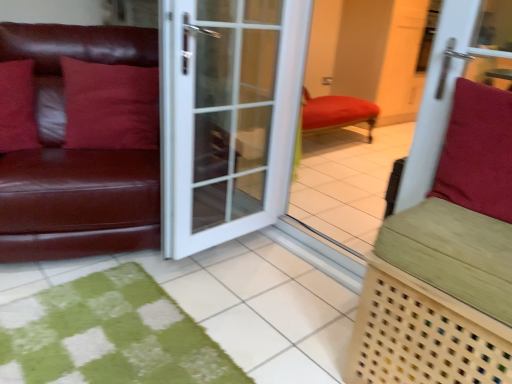
Question: Considering the relative positions of suede-like red cushion at right, which ranks as the first pillow in front-to-back order, and matte red pillow at left, the 2th pillow from the right, in the image provided, is suede-like red cushion at right, which ranks as the first pillow in front-to-back order, to the left of matte red pillow at left, the 2th pillow from the right, from the viewer's perspective?

Choices:
 (A) no
 (B) yes

Answer: (A)

Question: Considering the relative sizes of suede-like red cushion at right, arranged as the 1th pillow when viewed from the right, and matte red pillow at left, the 2th pillow from the right, in the image provided, is suede-like red cushion at right, arranged as the 1th pillow when viewed from the right, bigger than matte red pillow at left, the 2th pillow from the right,?

Choices:
 (A) no
 (B) yes

Answer: (A)

Question: Is suede-like red cushion at right, which ranks as the first pillow in front-to-back order, outside matte red pillow at left, marked as the third pillow in a front-to-back arrangement?

Choices:
 (A) no
 (B) yes

Answer: (B)

Question: Can you confirm if suede-like red cushion at right, which ranks as the first pillow in front-to-back order, is thinner than matte red pillow at left, the 2th pillow from the right?

Choices:
 (A) yes
 (B) no

Answer: (B)

Question: From a real-world perspective, is suede-like red cushion at right, which ranks as the first pillow in front-to-back order, located higher than matte red pillow at left, which appears as the 1th pillow when viewed from the back?

Choices:
 (A) no
 (B) yes

Answer: (B)

Question: In terms of height, does matte red pillow at left, which appears as the 1th pillow when viewed from the back, look taller or shorter compared to white glass door at center?

Choices:
 (A) short
 (B) tall

Answer: (A)

Question: Is point (135, 69) closer or farther from the camera than point (175, 46)?

Choices:
 (A) closer
 (B) farther

Answer: (B)

Question: From a real-world perspective, is matte red pillow at left, the 2th pillow from the right, above or below white glass door at center?

Choices:
 (A) below
 (B) above

Answer: (B)

Question: Is matte red pillow at left, which appears as the 1th pillow when viewed from the back, inside or outside of white glass door at center?

Choices:
 (A) inside
 (B) outside

Answer: (B)

Question: Is green woven bench at right bigger or smaller than matte leather pillow at left, which ranks as the third pillow in right-to-left order?

Choices:
 (A) small
 (B) big

Answer: (B)

Question: Considering the positions of green woven bench at right and matte leather pillow at left, which ranks as the third pillow in right-to-left order, in the image, is green woven bench at right wider or thinner than matte leather pillow at left, which ranks as the third pillow in right-to-left order,?

Choices:
 (A) thin
 (B) wide

Answer: (B)

Question: In the image, is green woven bench at right on the left side or the right side of matte leather pillow at left, which ranks as the third pillow in right-to-left order?

Choices:
 (A) right
 (B) left

Answer: (A)

Question: From a real-world perspective, is green woven bench at right physically located above or below matte leather pillow at left, the 2th pillow when ordered from back to front?

Choices:
 (A) below
 (B) above

Answer: (A)

Question: Is matte red pillow at left, the 2th pillow from the right, wider or thinner than matte leather couch at left?

Choices:
 (A) thin
 (B) wide

Answer: (A)

Question: Is matte red pillow at left, which appears as the 1th pillow when viewed from the back, in front of or behind matte leather couch at left in the image?

Choices:
 (A) behind
 (B) front

Answer: (A)